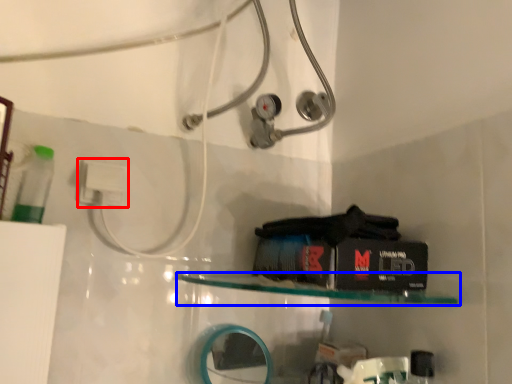
Question: Which of the following is the closest to the observer, electric outlet (highlighted by a red box) or shelf (highlighted by a blue box)?

Choices:
 (A) electric outlet
 (B) shelf

Answer: (B)